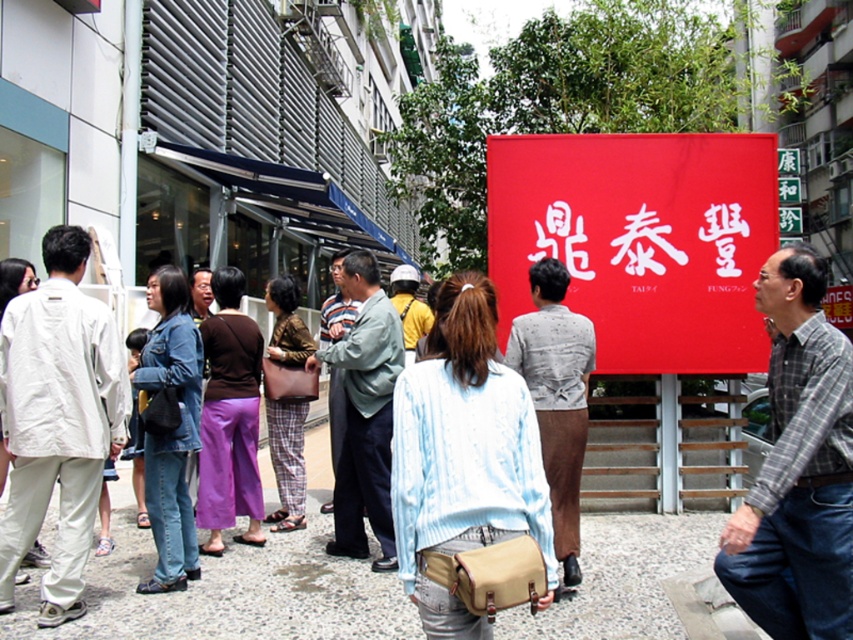
Who is shorter, red fabric sign at upper center or denim jacket at center?

red fabric sign at upper center

Between red fabric sign at upper center and denim jacket at center, which one appears on the right side from the viewer's perspective?

→ red fabric sign at upper center is more to the right.

Does point (619, 288) come behind point (25, 625)?

Yes, point (619, 288) is behind point (25, 625).

This screenshot has height=640, width=853. In order to click on red fabric sign at upper center in this screenshot , I will do `click(640, 241)`.